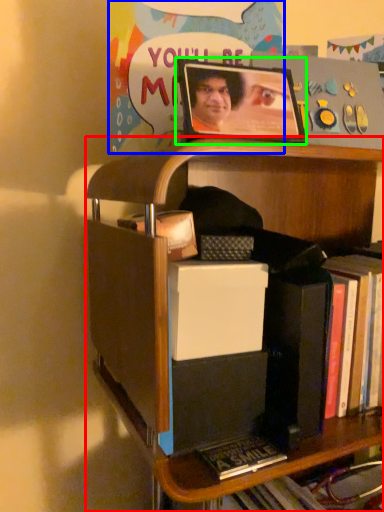
Question: Considering the real-world distances, which object is closest to shelf (highlighted by a red box)? postcard (highlighted by a blue box) or picture frame (highlighted by a green box).

Choices:
 (A) postcard
 (B) picture frame

Answer: (B)